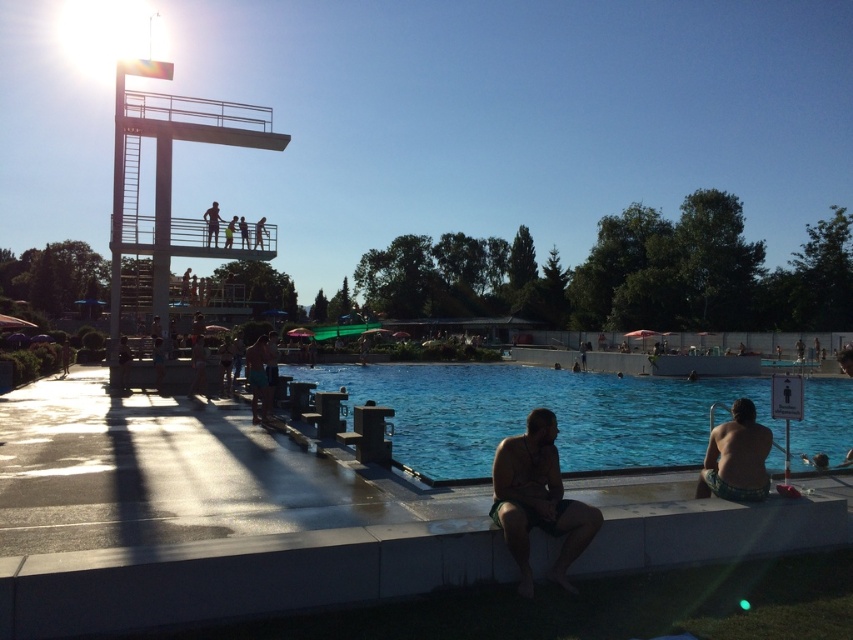
Question: Among these objects, which one is farthest from the camera?

Choices:
 (A) matte black shorts at upper center
 (B) blue glossy water at center
 (C) green textured shorts at lower right

Answer: (A)

Question: Among these objects, which one is nearest to the camera?

Choices:
 (A) dark green shorts at lower center
 (B) green textured shorts at lower right
 (C) tan skin human at upper center
 (D) skinny jeans at upper center

Answer: (A)

Question: Is blue glossy water at center below tan skin human at upper center?

Choices:
 (A) yes
 (B) no

Answer: (A)

Question: Does blue glossy water at center appear on the right side of tan skin human at upper center?

Choices:
 (A) yes
 (B) no

Answer: (A)

Question: Which object is positioned closest to the dark green shorts at lower center?

Choices:
 (A) blue glossy water at center
 (B) skinny jeans at upper center

Answer: (A)

Question: Does matte black shorts at upper center lie behind tan skin human at upper center?

Choices:
 (A) no
 (B) yes

Answer: (A)